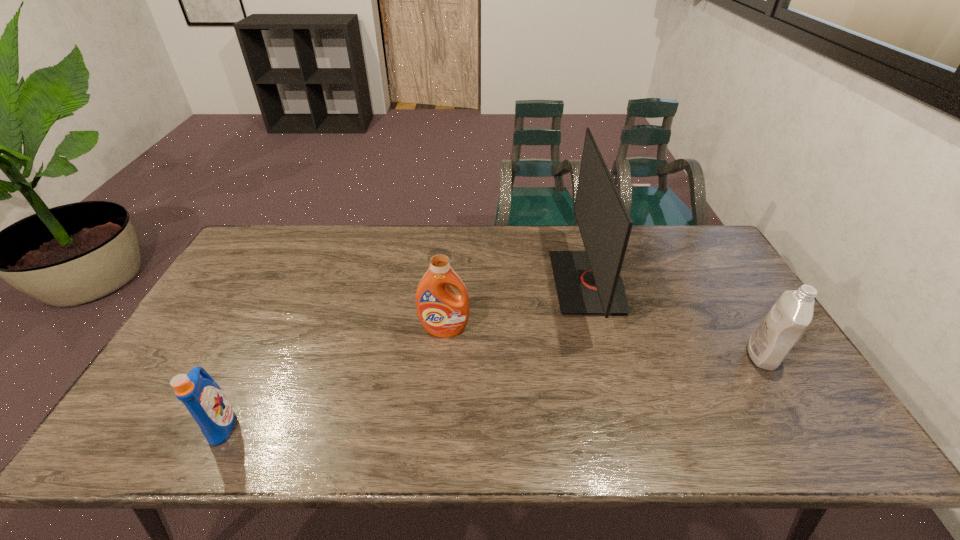
This screenshot has height=540, width=960. In order to click on free location that satisfies the following two spatial constraints: 1. on the back side of the rightmost detergent; 2. on the screen side of the monitor in this screenshot , I will do `click(718, 282)`.

Locate an element on the screen. vacant space that satisfies the following two spatial constraints: 1. on the front-facing side of the rightmost detergent; 2. on the right side of the second object from left to right is located at coordinates (443, 355).

Locate an element on the screen. This screenshot has width=960, height=540. free spot that satisfies the following two spatial constraints: 1. on the screen side of the rightmost object; 2. on the right side of the tallest object is located at coordinates (608, 355).

Find the location of a particular element. The image size is (960, 540). free space in the image that satisfies the following two spatial constraints: 1. on the front-facing side of the second detergent from left to right; 2. on the label of the leftmost object is located at coordinates (437, 424).

The width and height of the screenshot is (960, 540). Find the location of `free space that satisfies the following two spatial constraints: 1. on the screen side of the third object from left to right; 2. on the front-facing side of the farthest detergent`. free space that satisfies the following two spatial constraints: 1. on the screen side of the third object from left to right; 2. on the front-facing side of the farthest detergent is located at coordinates point(601,330).